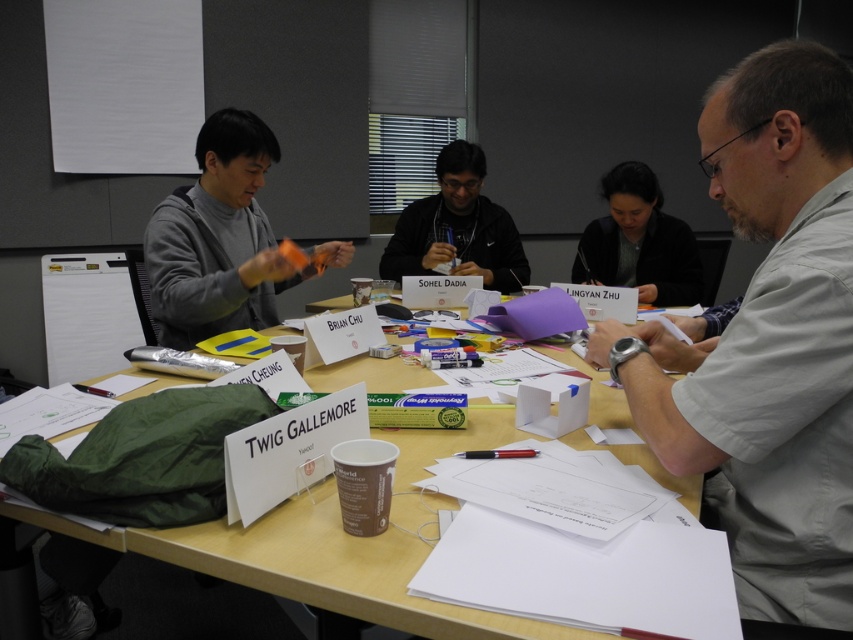
Between gray shirt at right and wooden table at center, which one appears on the left side from the viewer's perspective?

wooden table at center

Who is higher up, gray shirt at right or wooden table at center?

Positioned higher is gray shirt at right.

Between point (730, 536) and point (404, 513), which one is positioned in front?

Point (404, 513) is more forward.

Identify the location of gray shirt at right. (769, 340).

In the scene shown: Is wooden table at center shorter than matte black glasses at center?

Indeed, wooden table at center has a lesser height compared to matte black glasses at center.

Is wooden table at center to the right of matte black glasses at center from the viewer's perspective?

Correct, you'll find wooden table at center to the right of matte black glasses at center.

Between point (424, 611) and point (491, 228), which one is positioned in front?

Positioned in front is point (424, 611).

I want to click on wooden table at center, so click(x=325, y=547).

Does wooden table at center have a greater width compared to dark gray sweater at center?

Indeed, wooden table at center has a greater width compared to dark gray sweater at center.

Is wooden table at center bigger than dark gray sweater at center?

Yes, wooden table at center is bigger than dark gray sweater at center.

Does point (354, 541) come behind point (628, 168)?

That is False.

You are a GUI agent. You are given a task and a screenshot of the screen. Output one action in this format:
    pyautogui.click(x=<x>, y=<y>)
    Task: Click on the wooden table at center
    The height and width of the screenshot is (640, 853).
    Given the screenshot: What is the action you would take?
    pyautogui.click(x=325, y=547)